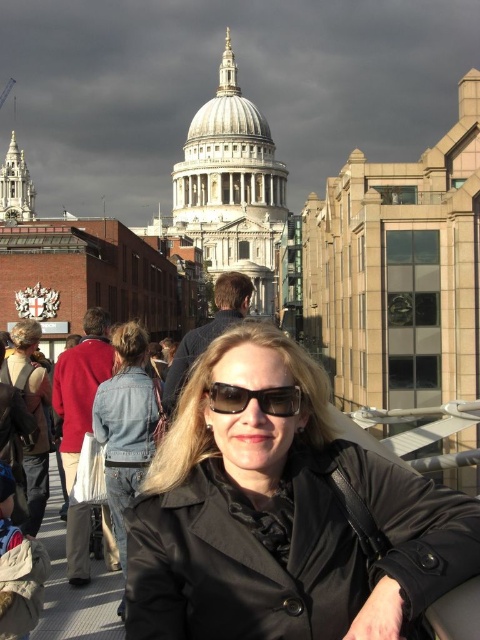
Is black matte jacket at center bigger than denim jacket at lower left?

Yes.

Is black matte jacket at center positioned before denim jacket at lower left?

That is True.

The image size is (480, 640). Identify the location of black matte jacket at center. (283, 516).

Locate an element on the screen. Image resolution: width=480 pixels, height=640 pixels. black matte jacket at center is located at coordinates (283, 516).

How far apart are denim jacket at lower left and black plastic sunglasses at center?

denim jacket at lower left and black plastic sunglasses at center are 17.85 meters apart from each other.

Consider the image. Which is more to the right, denim jacket at lower left or black plastic sunglasses at center?

black plastic sunglasses at center is more to the right.

This screenshot has height=640, width=480. I want to click on denim jacket at lower left, so click(x=127, y=424).

This screenshot has width=480, height=640. I want to click on denim jacket at lower left, so [x=127, y=424].

Is black matte jacket at center bigger than black plastic sunglasses at center?

Yes, black matte jacket at center is bigger than black plastic sunglasses at center.

Who is more forward, [347,593] or [260,397]?

Positioned in front is point [347,593].

At what (x,y) coordinates should I click in order to perform the action: click on black matte jacket at center. Please return your answer as a coordinate pair (x, y). This screenshot has width=480, height=640. Looking at the image, I should click on (283, 516).